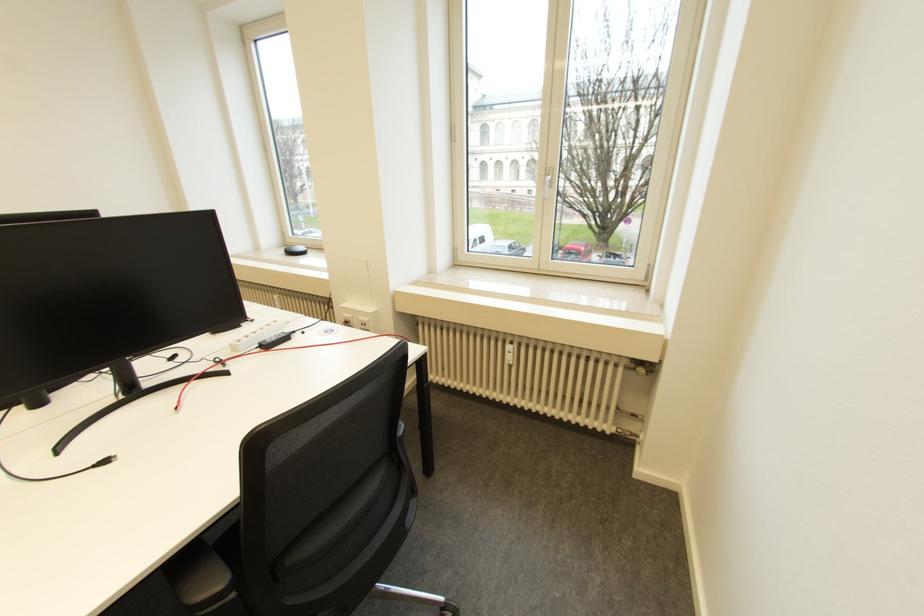
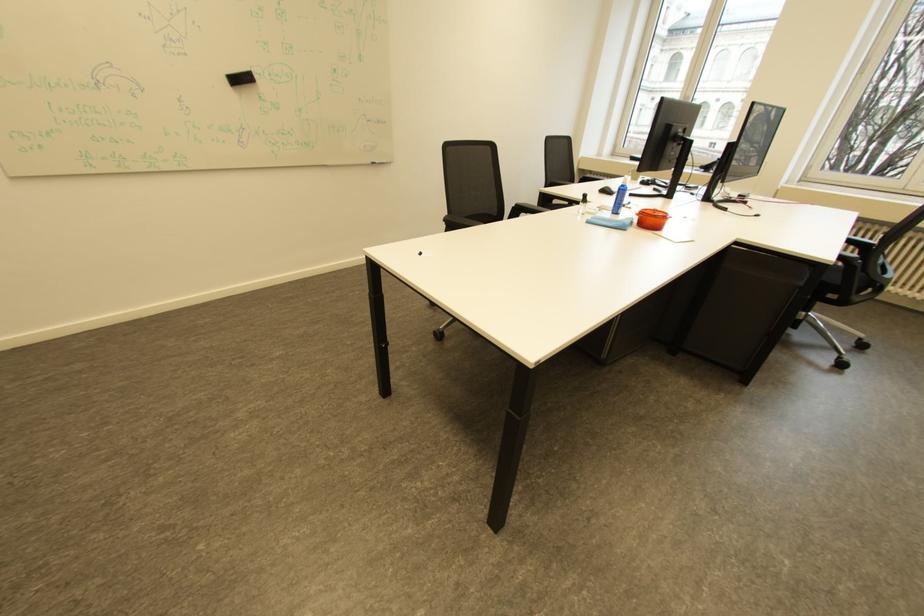
The images are taken continuously from a first-person perspective. In which direction are you moving?

The cameraman walked toward left, backward.